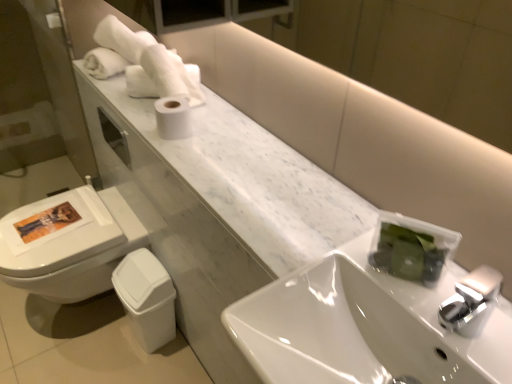
This screenshot has width=512, height=384. I want to click on free spot in front of white matte toilet paper at center, so (x=178, y=153).